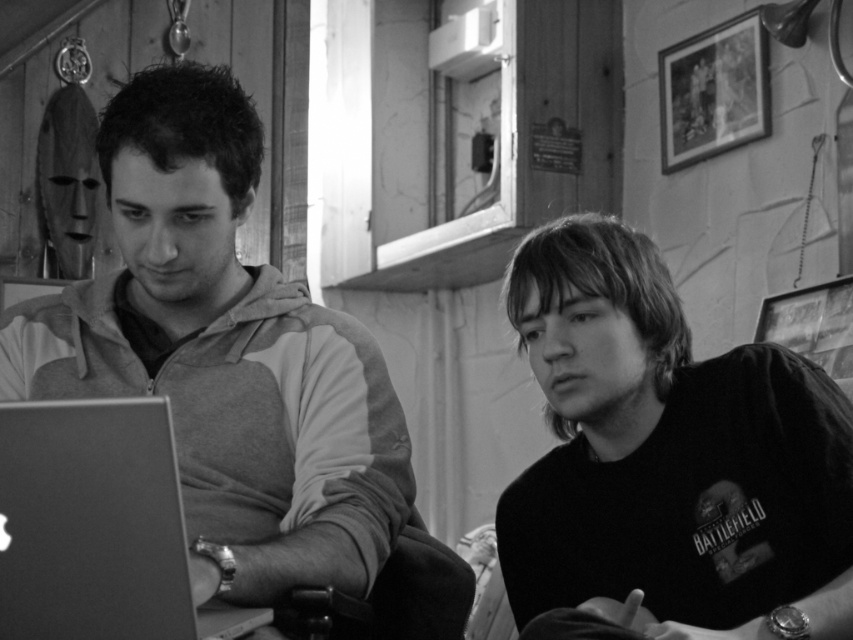
Question: Which of the following is the closest to the observer?

Choices:
 (A) (138, 173)
 (B) (643, 531)

Answer: (A)

Question: Which of the following is the farthest from the observer?

Choices:
 (A) smooth black shirt at right
 (B) matte gray hoodie at left

Answer: (A)

Question: Is matte gray hoodie at left to the left of smooth black shirt at right from the viewer's perspective?

Choices:
 (A) no
 (B) yes

Answer: (B)

Question: Which point is closer to the camera taking this photo?

Choices:
 (A) (9, 552)
 (B) (61, 314)
 (C) (645, 314)

Answer: (A)

Question: Is matte gray hoodie at left thinner than smooth black shirt at right?

Choices:
 (A) no
 (B) yes

Answer: (A)

Question: In this image, where is matte gray hoodie at left located relative to smooth black shirt at right?

Choices:
 (A) right
 (B) left

Answer: (B)